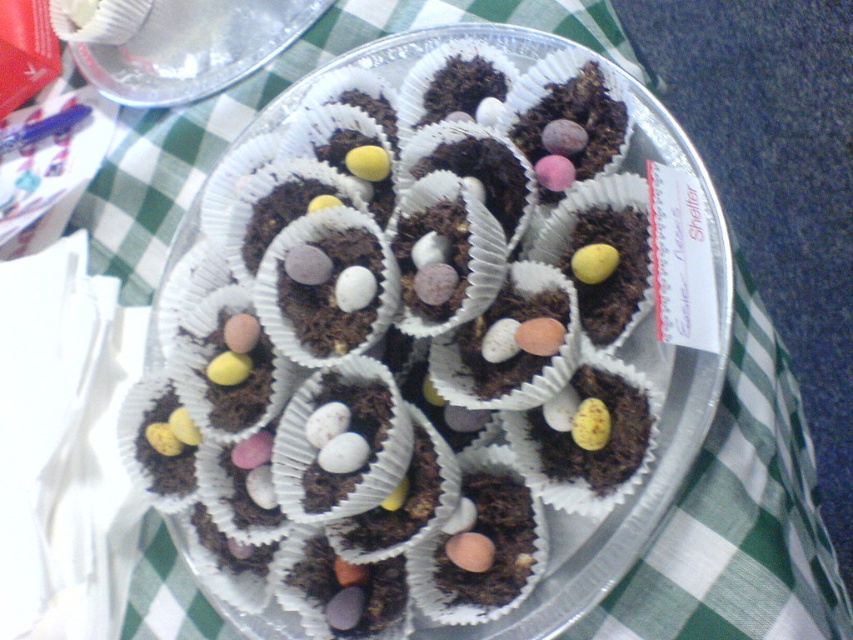
Who is higher up, chocolate cake at center or transparent plastic plate at upper center?

transparent plastic plate at upper center

Can you confirm if chocolate cake at center is positioned above transparent plastic plate at upper center?

Incorrect, chocolate cake at center is not positioned above transparent plastic plate at upper center.

Describe the element at coordinates (202, 186) in the screenshot. I see `chocolate cake at center` at that location.

Find the location of a particular element. The width and height of the screenshot is (853, 640). chocolate cake at center is located at coordinates (202, 186).